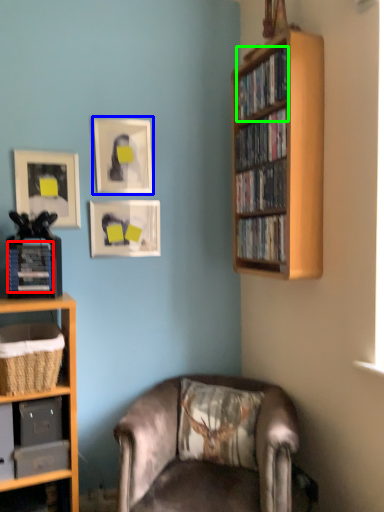
Question: Considering the real-world distances, which object is farthest from paperback book (highlighted by a red box)? picture frame (highlighted by a blue box) or book (highlighted by a green box)?

Choices:
 (A) picture frame
 (B) book

Answer: (B)